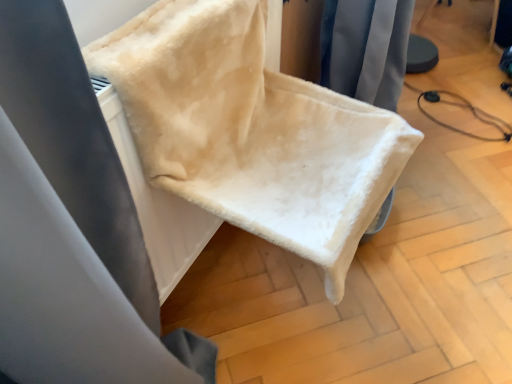
What do you see at coordinates (251, 130) in the screenshot? The height and width of the screenshot is (384, 512). I see `white fleece blanket at center` at bounding box center [251, 130].

Locate an element on the screen. white fleece blanket at center is located at coordinates (251, 130).

Locate an element on the screen. Image resolution: width=512 pixels, height=384 pixels. beige fleece blanket at upper left is located at coordinates (72, 226).

The height and width of the screenshot is (384, 512). Describe the element at coordinates (72, 226) in the screenshot. I see `beige fleece blanket at upper left` at that location.

Where is `white fleece blanket at center`? The image size is (512, 384). white fleece blanket at center is located at coordinates (251, 130).

Between white fleece blanket at center and beige fleece blanket at upper left, which one appears on the right side from the viewer's perspective?

From the viewer's perspective, white fleece blanket at center appears more on the right side.

Between white fleece blanket at center and beige fleece blanket at upper left, which one is positioned in front?

white fleece blanket at center is more forward.

Considering the positions of point (326, 257) and point (14, 362), is point (326, 257) closer or farther from the camera than point (14, 362)?

Point (326, 257) appears to be farther away from the viewer than point (14, 362).

From the image's perspective, is white fleece blanket at center on beige fleece blanket at upper left?

Correct, white fleece blanket at center appears higher than beige fleece blanket at upper left in the image.

Based on the photo, from a real-world perspective, between white fleece blanket at center and beige fleece blanket at upper left, who is vertically higher?

white fleece blanket at center is physically above.

Consider the image. Can you confirm if white fleece blanket at center is thinner than beige fleece blanket at upper left?

No.

Considering the relative sizes of white fleece blanket at center and beige fleece blanket at upper left in the image provided, is white fleece blanket at center shorter than beige fleece blanket at upper left?

Yes, white fleece blanket at center is shorter than beige fleece blanket at upper left.

Is white fleece blanket at center smaller than beige fleece blanket at upper left?

No, white fleece blanket at center is not smaller than beige fleece blanket at upper left.

Is beige fleece blanket at upper left a part of white fleece blanket at center?

Yes, white fleece blanket at center contains beige fleece blanket at upper left.

Is there a large distance between white fleece blanket at center and beige fleece blanket at upper left?

white fleece blanket at center is actually quite close to beige fleece blanket at upper left.

Is white fleece blanket at center oriented towards beige fleece blanket at upper left?

No, white fleece blanket at center does not turn towards beige fleece blanket at upper left.

Image resolution: width=512 pixels, height=384 pixels. What are the coordinates of `furniture in front of the beige fleece blanket at upper left` in the screenshot? It's located at (251, 130).

Is beige fleece blanket at upper left to the left of white fleece blanket at center from the viewer's perspective?

Indeed, beige fleece blanket at upper left is positioned on the left side of white fleece blanket at center.

Which object is closer to the camera taking this photo, beige fleece blanket at upper left or white fleece blanket at center?

white fleece blanket at center is in front.

Is point (115, 171) closer or farther from the camera than point (222, 102)?

Point (115, 171) appears to be closer to the viewer than point (222, 102).

From the image's perspective, is beige fleece blanket at upper left beneath white fleece blanket at center?

Yes, from the image's perspective, beige fleece blanket at upper left is below white fleece blanket at center.

From a real-world perspective, which object stands above the other?

In real-world perspective, white fleece blanket at center is above.

Does beige fleece blanket at upper left have a greater width compared to white fleece blanket at center?

No, beige fleece blanket at upper left is not wider than white fleece blanket at center.

Considering the sizes of beige fleece blanket at upper left and white fleece blanket at center in the image, is beige fleece blanket at upper left taller or shorter than white fleece blanket at center?

Clearly, beige fleece blanket at upper left is taller compared to white fleece blanket at center.

Does beige fleece blanket at upper left have a smaller size compared to white fleece blanket at center?

Yes, beige fleece blanket at upper left is smaller than white fleece blanket at center.

Is beige fleece blanket at upper left situated inside white fleece blanket at center or outside?

beige fleece blanket at upper left is spatially positioned inside white fleece blanket at center.

Is beige fleece blanket at upper left beside white fleece blanket at center?

There is a gap between beige fleece blanket at upper left and white fleece blanket at center.

Is beige fleece blanket at upper left oriented towards white fleece blanket at center?

Yes.

What's the angular difference between beige fleece blanket at upper left and white fleece blanket at center's facing directions?

The angle between the facing direction of beige fleece blanket at upper left and the facing direction of white fleece blanket at center is 0.514 degrees.

How distant is beige fleece blanket at upper left from white fleece blanket at center?

beige fleece blanket at upper left is 14.15 inches away from white fleece blanket at center.

In order to click on furniture lying above the beige fleece blanket at upper left (from the image's perspective) in this screenshot , I will do tap(251, 130).

You are a GUI agent. You are given a task and a screenshot of the screen. Output one action in this format:
    pyautogui.click(x=<x>, y=<y>)
    Task: Click on the furniture in front of the beige fleece blanket at upper left
    
    Given the screenshot: What is the action you would take?
    pyautogui.click(x=251, y=130)

Where is `curtain located behind the white fleece blanket at center`? curtain located behind the white fleece blanket at center is located at coordinates (72, 226).